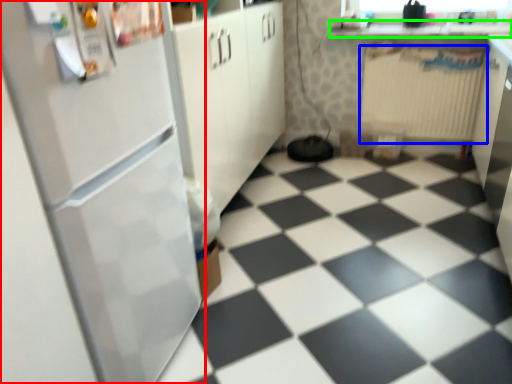
Question: Which is nearer to the refrigerator (highlighted by a red box)? radiator (highlighted by a blue box) or counter top (highlighted by a green box).

Choices:
 (A) radiator
 (B) counter top

Answer: (A)